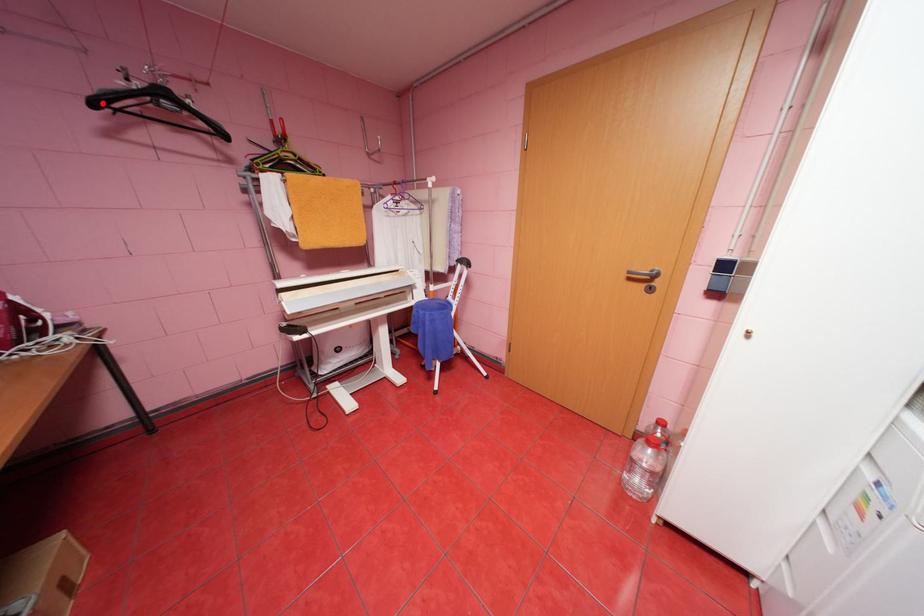
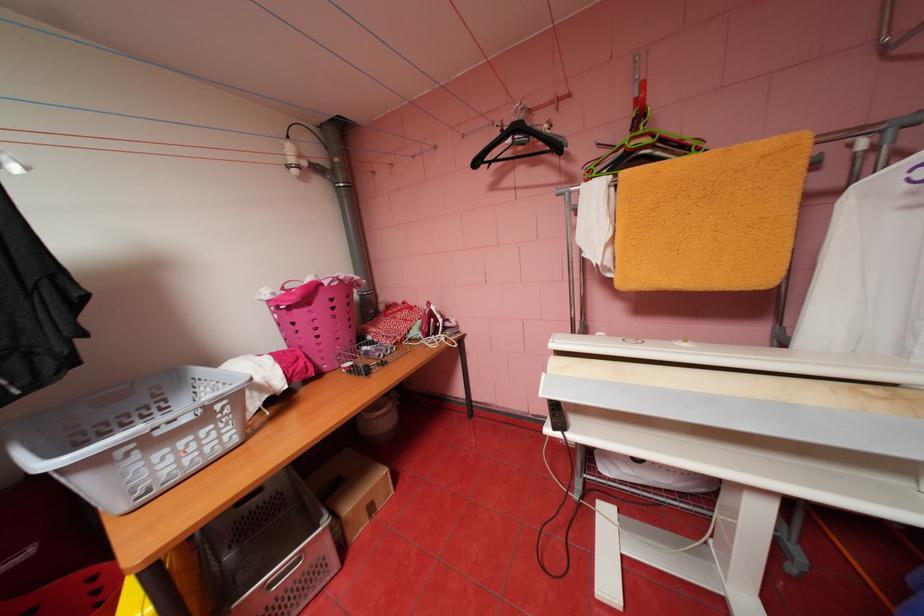
In the second image, find the point that corresponds to the highlighted location in the first image.

(484, 163)